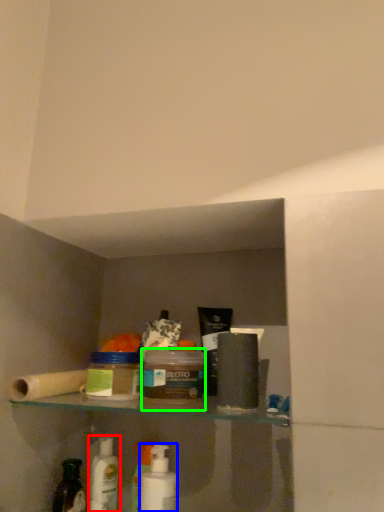
Question: Which object is the closest to the mouthwash (highlighted by a red box)? Choose among these: mouthwash (highlighted by a blue box) or product (highlighted by a green box).

Choices:
 (A) mouthwash
 (B) product

Answer: (A)